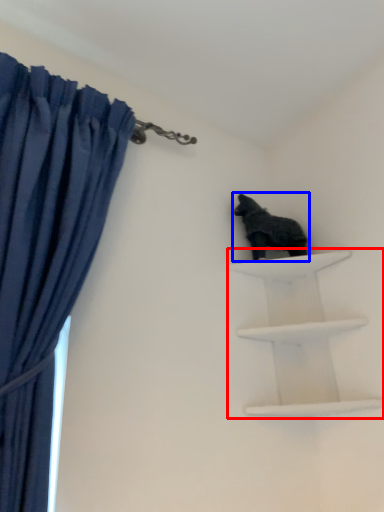
Question: Which object is closer to the camera taking this photo, shelf (highlighted by a red box) or animal (highlighted by a blue box)?

Choices:
 (A) shelf
 (B) animal

Answer: (A)